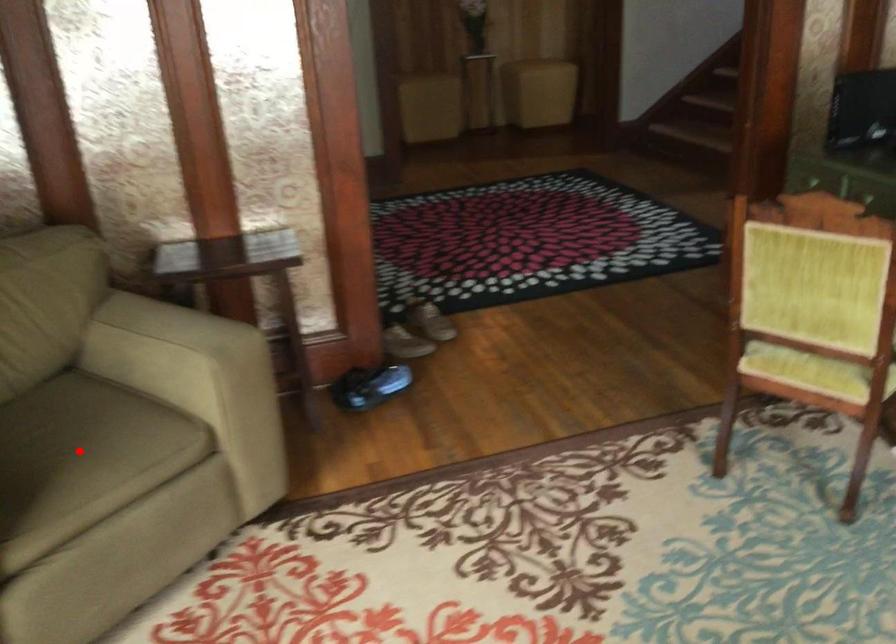
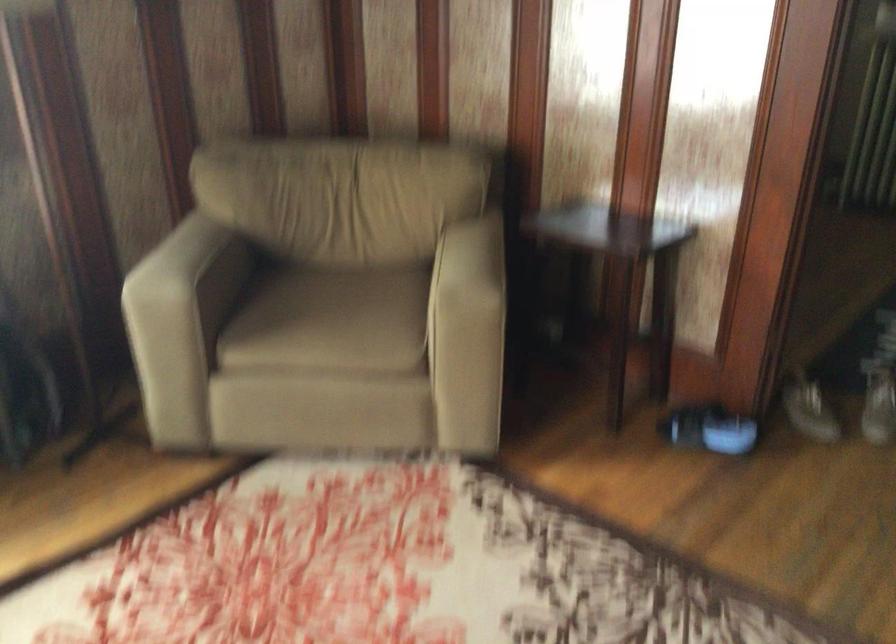
Question: I am providing you with two images of the same scene from different viewpoints. Image1 has a red point marked. In image2, the corresponding 3D location appears at what relative position? Reply with the corresponding letter.

Choices:
 (A) Closer
 (B) Farther

Answer: (B)